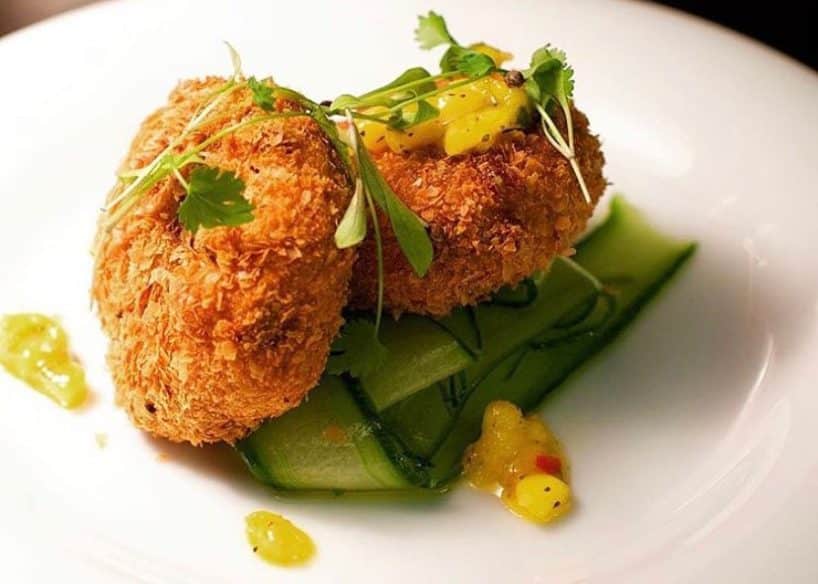
Identify the location of white plate. This screenshot has width=818, height=584. (712, 140).